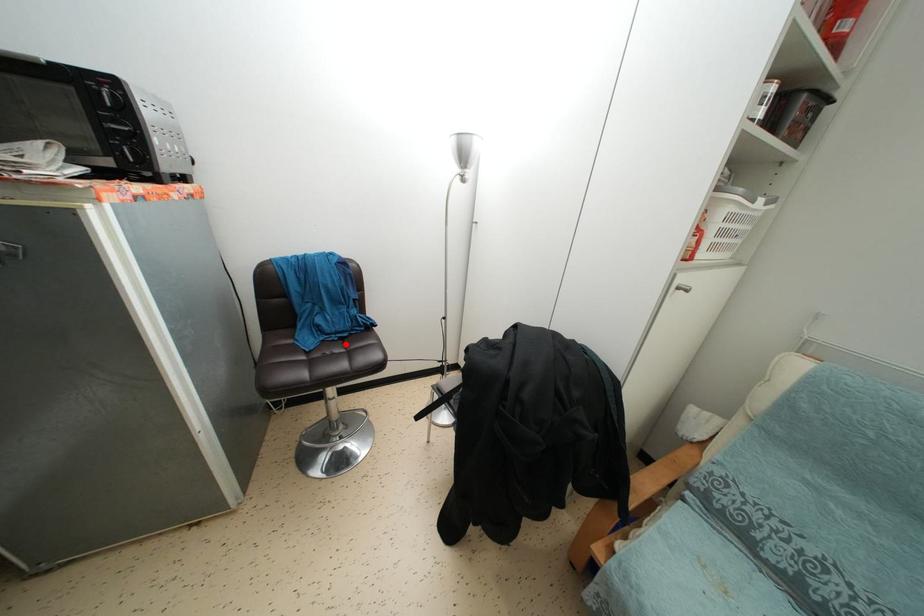
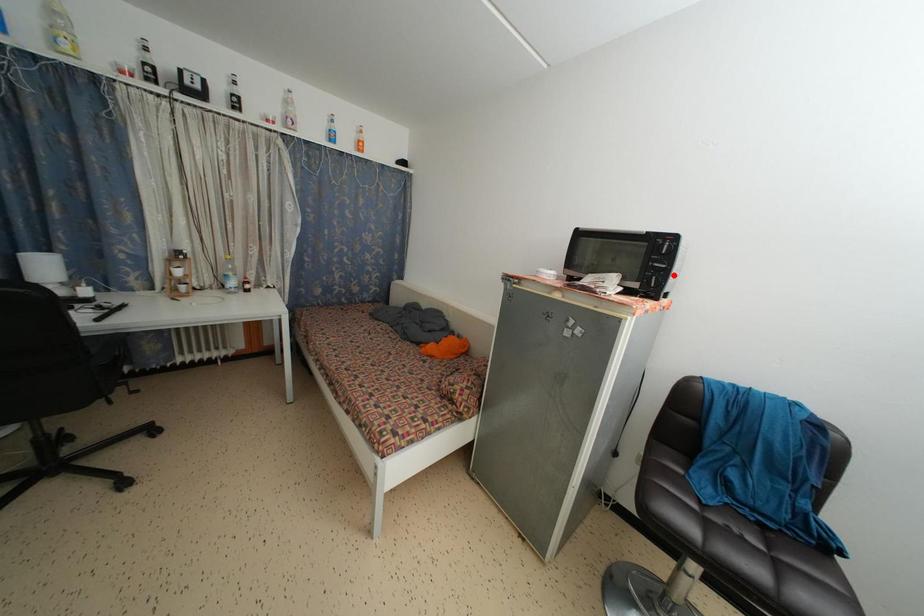
I am providing you with two images of the same scene from different viewpoints. A red point is marked on the first image and another point is marked on the second image. Do the highlighted points in image1 and image2 indicate the same real-world spot?

No